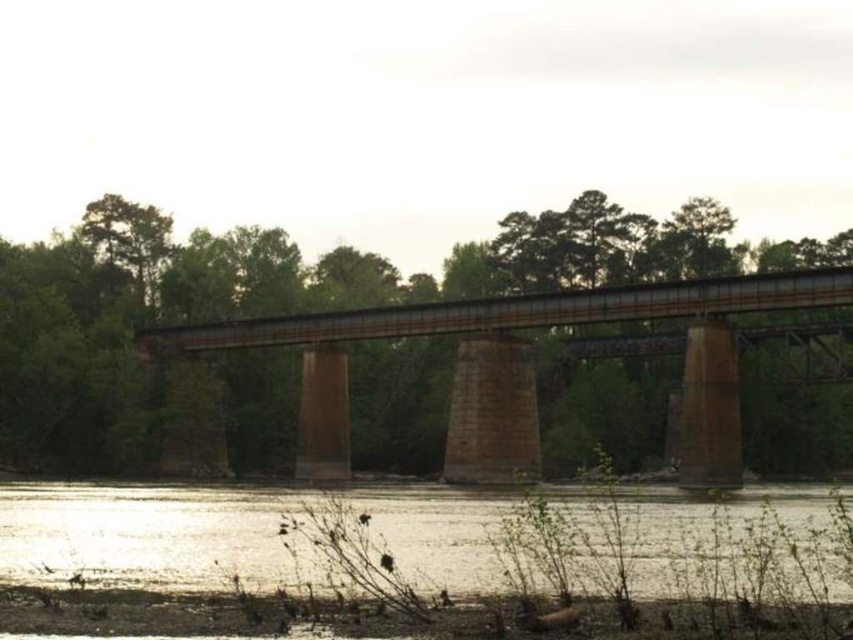
Question: Does silvery reflective water at lower center have a smaller size compared to rusty metal bridge at center?

Choices:
 (A) no
 (B) yes

Answer: (B)

Question: Can you confirm if silvery reflective water at lower center is bigger than rusty metal bridge at center?

Choices:
 (A) yes
 (B) no

Answer: (B)

Question: Is silvery reflective water at lower center below rusty metal bridge at center?

Choices:
 (A) no
 (B) yes

Answer: (B)

Question: Which point is farther to the camera?

Choices:
 (A) (451, 570)
 (B) (635, 294)

Answer: (B)

Question: Which point is farther to the camera?

Choices:
 (A) rusty metal bridge at center
 (B) silvery reflective water at lower center

Answer: (A)

Question: Which point appears farthest from the camera in this image?

Choices:
 (A) (477, 538)
 (B) (343, 460)

Answer: (B)